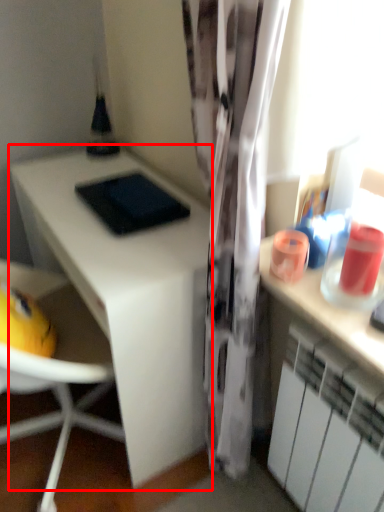
Question: From the image's perspective, where is desk (annotated by the red box) located relative to cabinetry?

Choices:
 (A) below
 (B) above

Answer: (B)